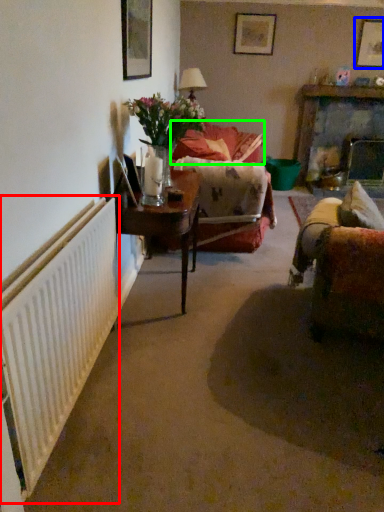
Question: Considering the real-world distances, which object is farthest from radiator (highlighted by a red box)? picture frame (highlighted by a blue box) or couch (highlighted by a green box)?

Choices:
 (A) picture frame
 (B) couch

Answer: (A)